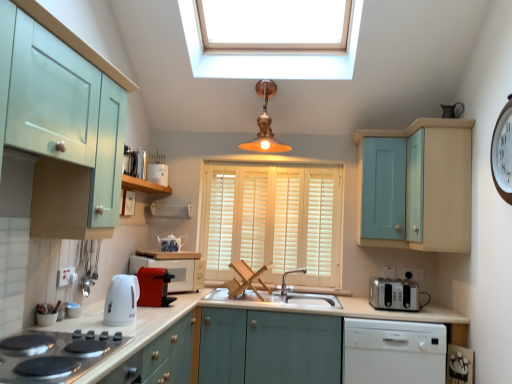
Find the location of a particular element. The height and width of the screenshot is (384, 512). free spot in front of white glossy electric kettle at lower left is located at coordinates (110, 329).